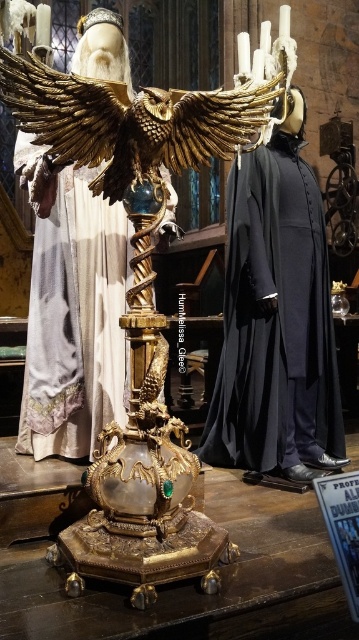
Does dark blue velvet robe at center have a greater height compared to gold textured eagle at center?

Correct, dark blue velvet robe at center is much taller as gold textured eagle at center.

Is dark blue velvet robe at center behind gold textured eagle at center?

That is True.

This screenshot has height=640, width=359. Find the location of `dark blue velvet robe at center`. dark blue velvet robe at center is located at coordinates (274, 321).